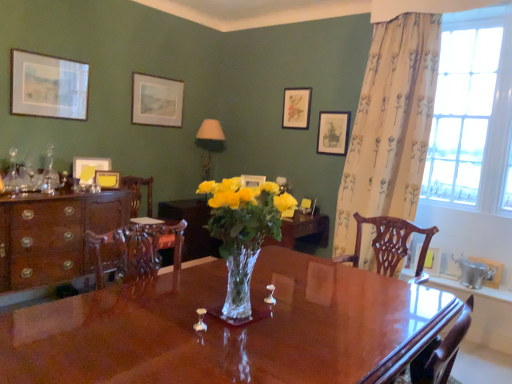
Find the location of a particular element. The width and height of the screenshot is (512, 384). free space to the left of clear glass vase at center is located at coordinates (132, 329).